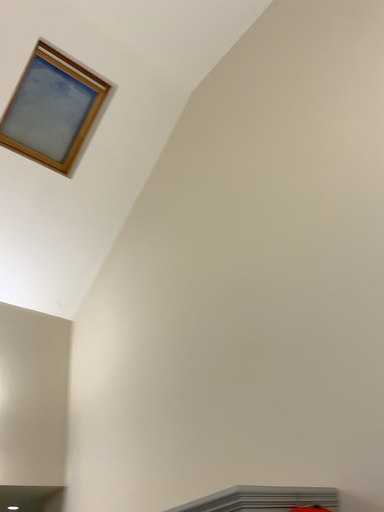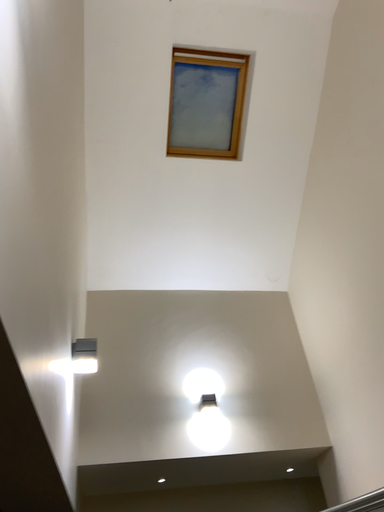
Question: How did the camera likely rotate when shooting the video?

Choices:
 (A) rotated upward
 (B) rotated downward

Answer: (B)